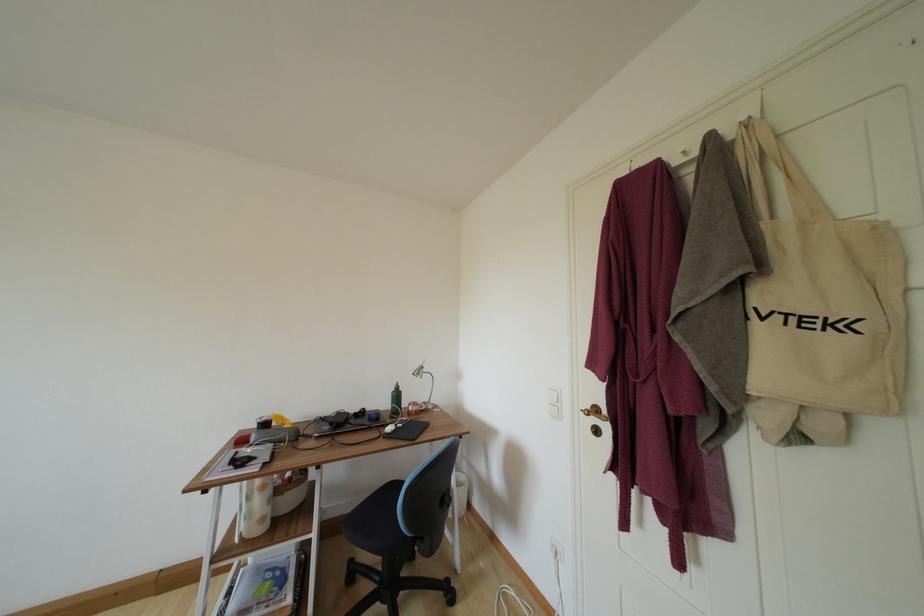
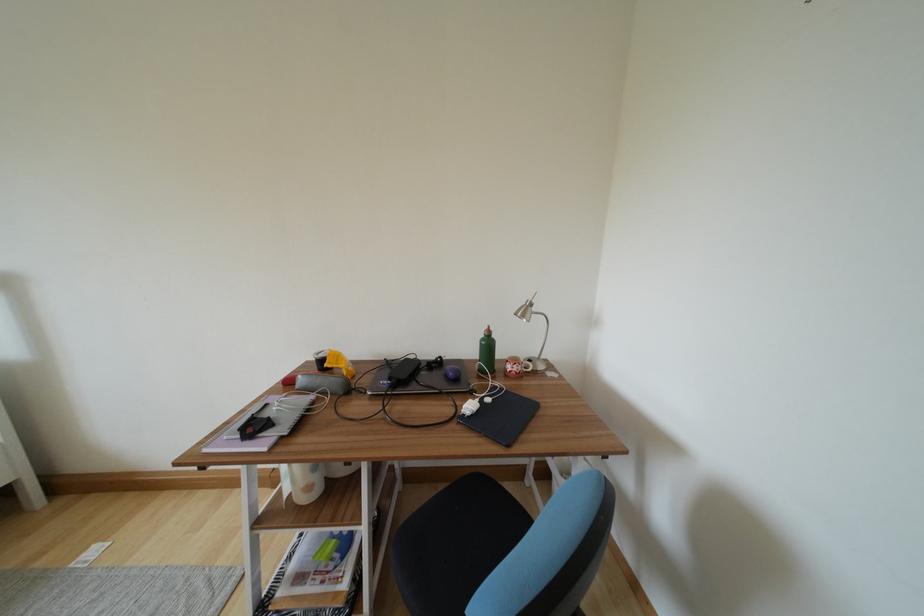
Based on the continuous images, in which direction is the camera rotating?

The camera rotated toward left-down.